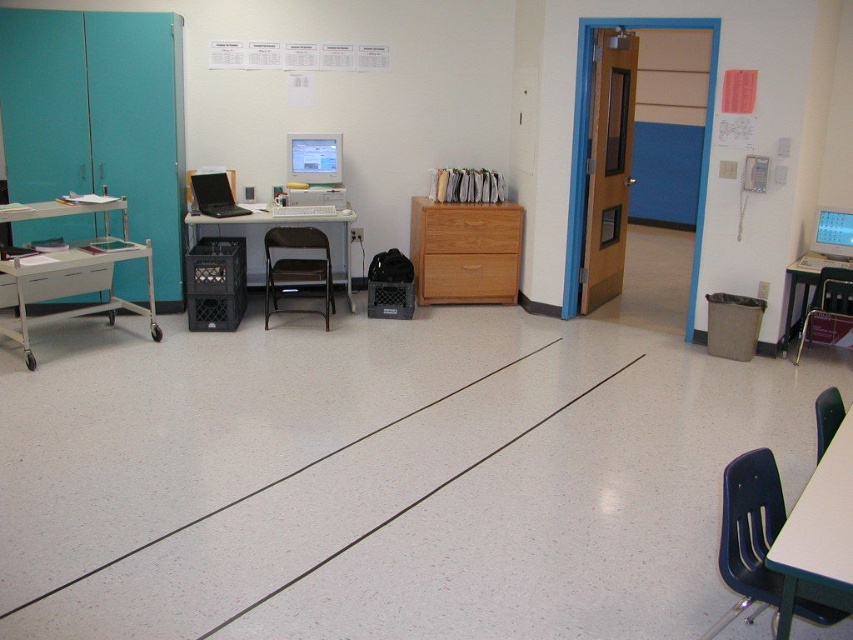
Which is more to the right, teal matte/file cabinet at left or matte black computer desk at right?

matte black computer desk at right is more to the right.

Which of these two, teal matte/file cabinet at left or matte black computer desk at right, stands shorter?

Standing shorter between the two is matte black computer desk at right.

Describe the element at coordinates (99, 118) in the screenshot. Image resolution: width=853 pixels, height=640 pixels. I see `teal matte/file cabinet at left` at that location.

Identify the location of teal matte/file cabinet at left. (99, 118).

Is metallic silver cart at left taller than matte blue plastic chair at lower right?

Yes, metallic silver cart at left is taller than matte blue plastic chair at lower right.

The height and width of the screenshot is (640, 853). In order to click on metallic silver cart at left in this screenshot , I will do `click(71, 269)`.

Locate an element on the screen. Image resolution: width=853 pixels, height=640 pixels. metallic silver cart at left is located at coordinates (71, 269).

Is the position of matte blue plastic chair at lower right more distant than that of matte gray monitor at right?

That is False.

The width and height of the screenshot is (853, 640). Find the location of `matte blue plastic chair at lower right`. matte blue plastic chair at lower right is located at coordinates 749,534.